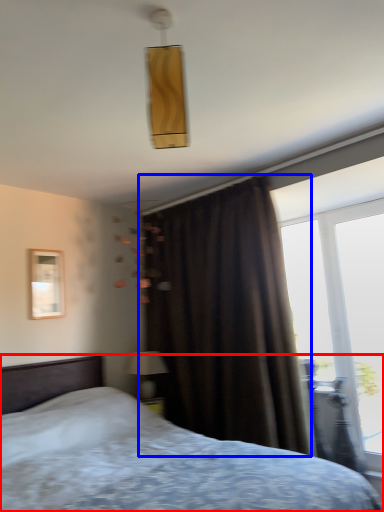
Question: Among these objects, which one is farthest to the camera, bed (highlighted by a red box) or curtain (highlighted by a blue box)?

Choices:
 (A) bed
 (B) curtain

Answer: (B)